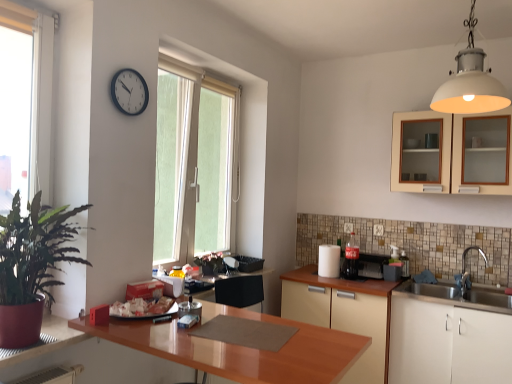
Question: Considering the positions of green leafy plant at left and white paper towel at center, the first appliance when ordered from left to right, in the image, is green leafy plant at left taller or shorter than white paper towel at center, the first appliance when ordered from left to right,?

Choices:
 (A) short
 (B) tall

Answer: (B)

Question: Based on their sizes in the image, would you say green leafy plant at left is bigger or smaller than white paper towel at center, the 3th appliance from the right?

Choices:
 (A) big
 (B) small

Answer: (A)

Question: Which of these objects is positioned closest to the green leafy plant at left?

Choices:
 (A) clear glass soda bottle at center-right, which ranks as the 2th appliance in right-to-left order
 (B) silver metallic faucet at lower right
 (C) beige matte cabinet at lower center, the second cabinetry viewed from the top
 (D) black plastic clock at upper center
 (E) white matte cabinet at lower right, the third cabinetry when ordered from top to bottom

Answer: (D)

Question: Considering the real-world distances, which object is closest to the green frosted glass window at center, which is counted as the 1th window, starting from the right?

Choices:
 (A) silver metallic faucet at lower right
 (B) beige matte cabinet at lower center, the second cabinetry viewed from the top
 (C) metallic silver toaster at right, which is counted as the 3th appliance, starting from the left
 (D) glossy wood countertop at center
 (E) matte cream cabinet at upper right, the 1th cabinetry viewed from the top

Answer: (B)